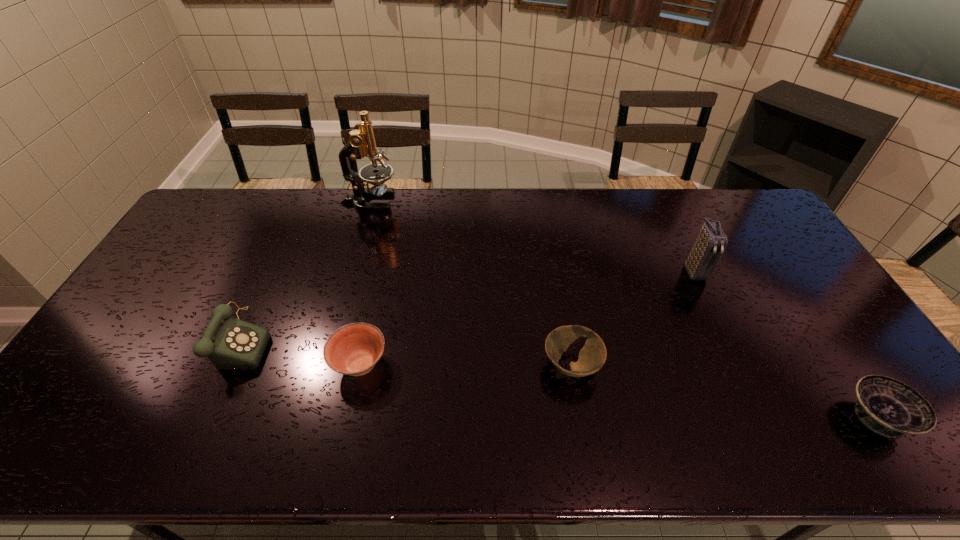
Locate an element on the screen. The width and height of the screenshot is (960, 540). free space that satisfies the following two spatial constraints: 1. on the dial of the telephone; 2. on the back side of the second bowl from right to left is located at coordinates [x=229, y=365].

In order to click on free space that satisfies the following two spatial constraints: 1. on the back side of the second bowl from left to right; 2. at the eyepiece of the farthest object in this screenshot , I will do `click(544, 201)`.

Find the location of a particular element. vacant space that satisfies the following two spatial constraints: 1. at the eyepiece of the farthest object; 2. on the left side of the leftmost bowl is located at coordinates (324, 364).

Image resolution: width=960 pixels, height=540 pixels. In order to click on vacant region that satisfies the following two spatial constraints: 1. at the eyepiece of the second bowl from right to left; 2. on the right side of the tallest object in this screenshot , I will do `click(324, 365)`.

Where is `vacant space that satisfies the following two spatial constraints: 1. on the dial of the second bowl from left to right; 2. on the right side of the telephone`? The width and height of the screenshot is (960, 540). vacant space that satisfies the following two spatial constraints: 1. on the dial of the second bowl from left to right; 2. on the right side of the telephone is located at coordinates (229, 365).